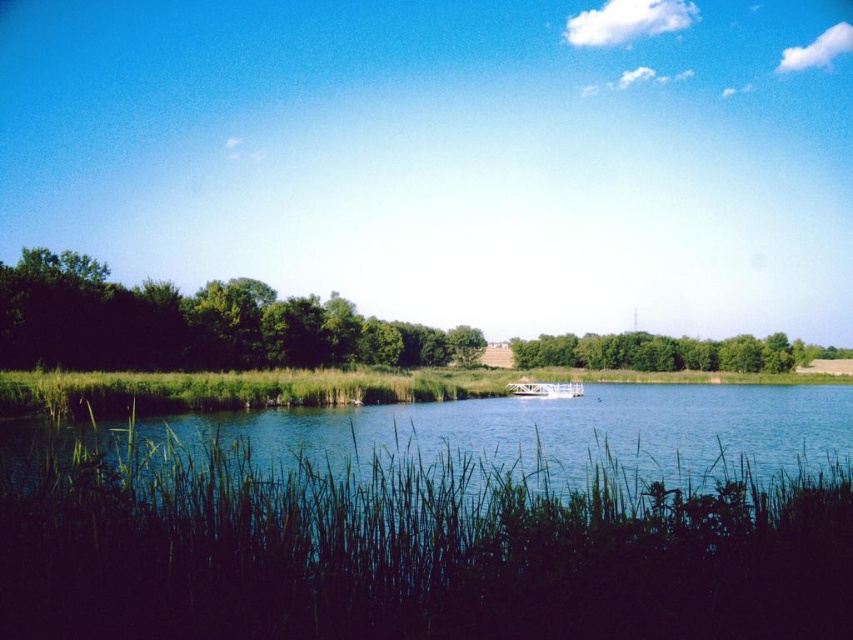
In the scene shown: Can you confirm if green grassy river at center is thinner than dark green leafy trees at left?

In fact, green grassy river at center might be wider than dark green leafy trees at left.

Is point (693, 451) less distant than point (325, 326)?

Yes, point (693, 451) is in front of point (325, 326).

Does point (149, 468) come closer to viewer compared to point (300, 346)?

Yes, it is in front of point (300, 346).

The height and width of the screenshot is (640, 853). What are the coordinates of `green grassy river at center` in the screenshot? It's located at (491, 438).

Does green grassy river at center appear under green leafy trees at center?

Yes.

Between green grassy river at center and green leafy trees at center, which one is positioned higher?

Positioned higher is green leafy trees at center.

Between point (759, 424) and point (747, 352), which one is positioned in front?

Point (759, 424) is more forward.

Locate an element on the screen. This screenshot has width=853, height=640. green grassy river at center is located at coordinates (491, 438).

What do you see at coordinates (669, 353) in the screenshot?
I see `green leafy trees at center` at bounding box center [669, 353].

Is green leafy trees at center taller than white glossy boat at center?

Indeed, green leafy trees at center has a greater height compared to white glossy boat at center.

Find the location of a particular element. The height and width of the screenshot is (640, 853). green leafy trees at center is located at coordinates (669, 353).